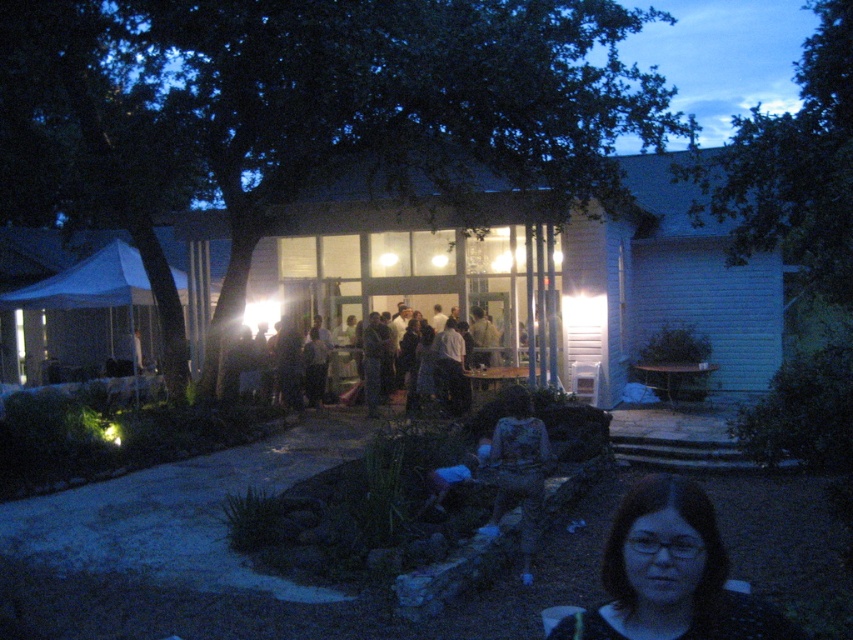
Is brown hair at lower right to the right of dark clothing at center from the viewer's perspective?

Correct, you'll find brown hair at lower right to the right of dark clothing at center.

Between brown hair at lower right and dark clothing at center, which one has more height?

With more height is dark clothing at center.

Who is more forward, (635, 598) or (454, 337)?

Point (635, 598)

At what (x,y) coordinates should I click in order to perform the action: click on brown hair at lower right. Please return your answer as a coordinate pair (x, y). The height and width of the screenshot is (640, 853). Looking at the image, I should click on (669, 573).

Looking at this image, how far apart are brown hair at lower right and camouflage fabric shirt at center?

The distance of brown hair at lower right from camouflage fabric shirt at center is 4.79 meters.

Does point (621, 636) come behind point (534, 499)?

No.

Locate an element on the screen. This screenshot has height=640, width=853. brown hair at lower right is located at coordinates (669, 573).

Is point (492, 525) less distant than point (453, 413)?

Yes, it is in front of point (453, 413).

Who is higher up, camouflage fabric shirt at center or dark clothing at center?

dark clothing at center is above.

Where is `camouflage fabric shirt at center`? camouflage fabric shirt at center is located at coordinates (519, 470).

Locate an element on the screen. camouflage fabric shirt at center is located at coordinates (519, 470).